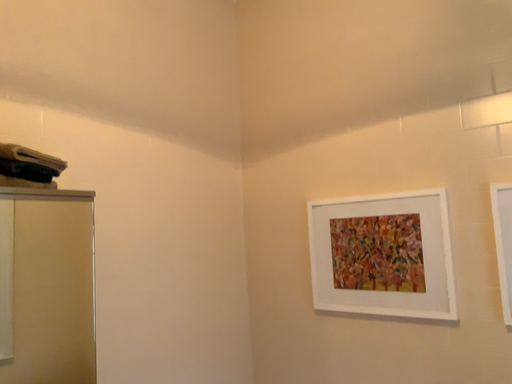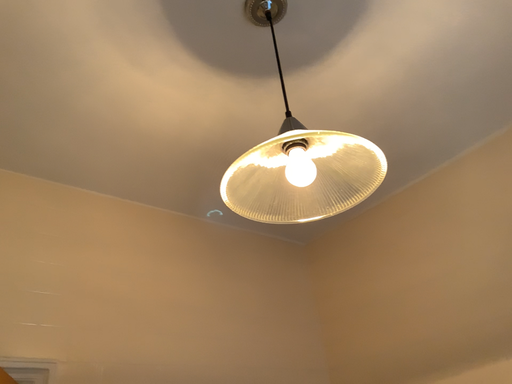
Question: How did the camera likely rotate when shooting the video?

Choices:
 (A) rotated left
 (B) rotated right

Answer: (A)